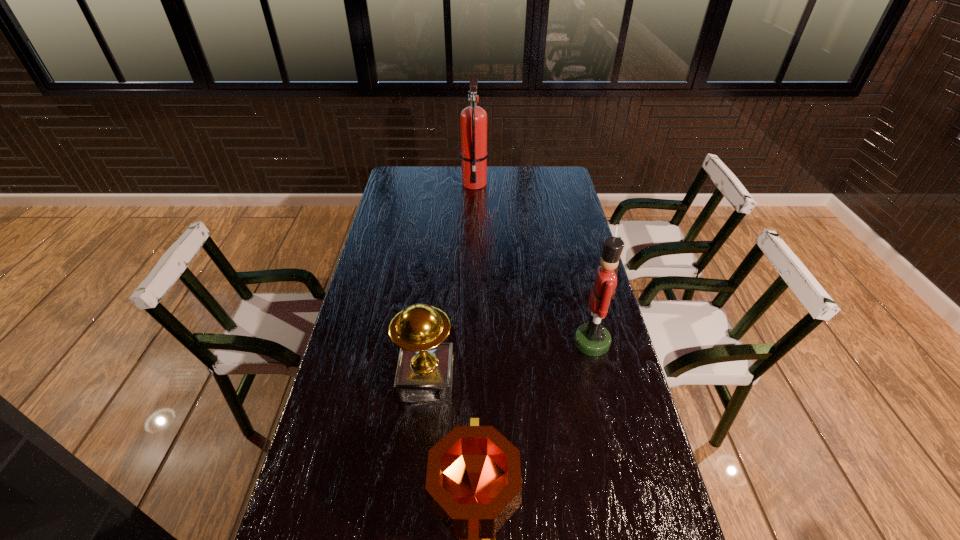
The image size is (960, 540). What are the coordinates of `the closest object to the fire extinguisher` in the screenshot? It's located at (592, 339).

Identify the location of vacant point that satisfies the following two spatial constraints: 1. on the front-facing side of the rightmost object; 2. on the front-facing side of the second nearest object. This screenshot has width=960, height=540. 601,380.

This screenshot has height=540, width=960. Identify the location of vacant space that satisfies the following two spatial constraints: 1. on the front-facing side of the rightmost object; 2. on the front-facing side of the farther award. (601, 380).